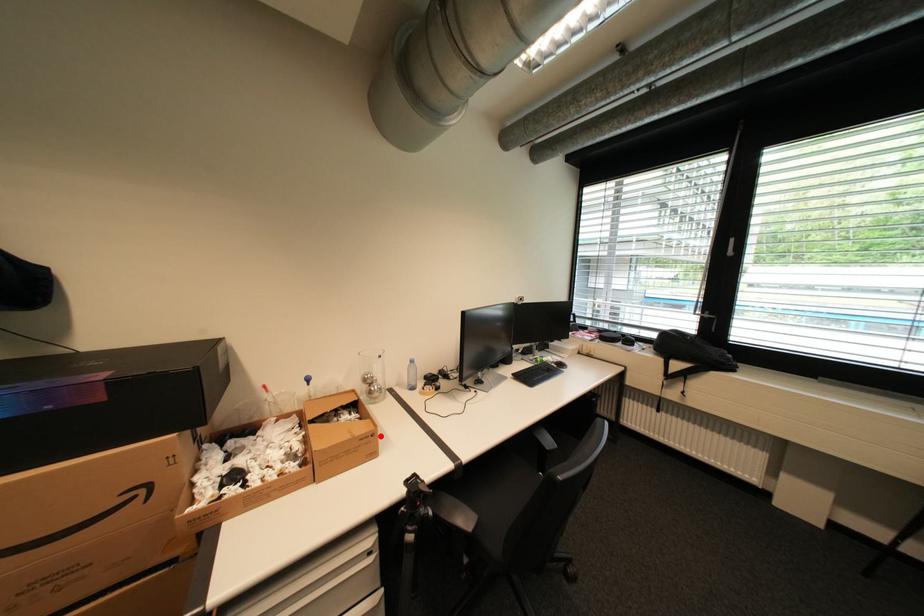
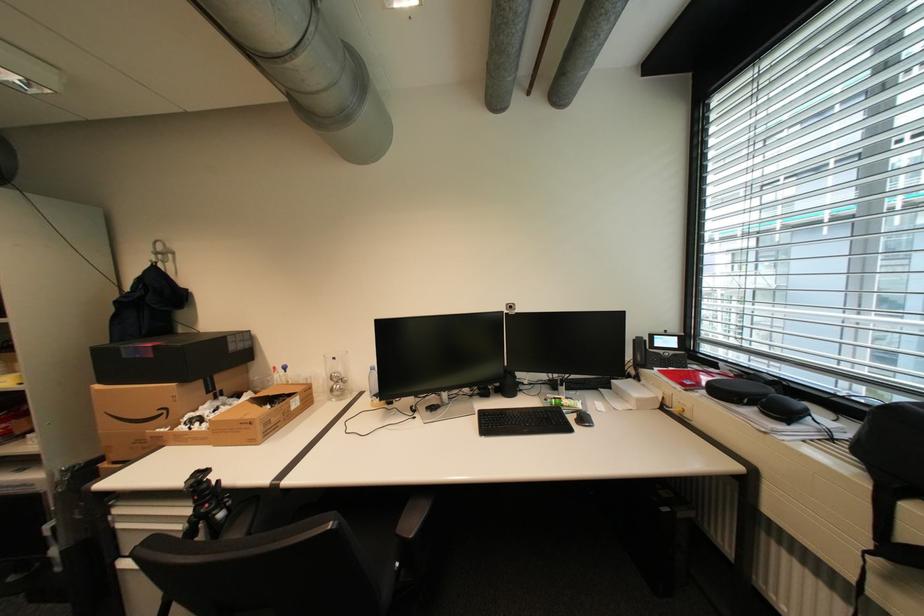
Question: I am providing you with two images of the same scene from different viewpoints. A red point is shown in image1. For the corresponding object point in image2, is it positioned nearer or farther from the camera?

Choices:
 (A) Nearer
 (B) Farther

Answer: (B)